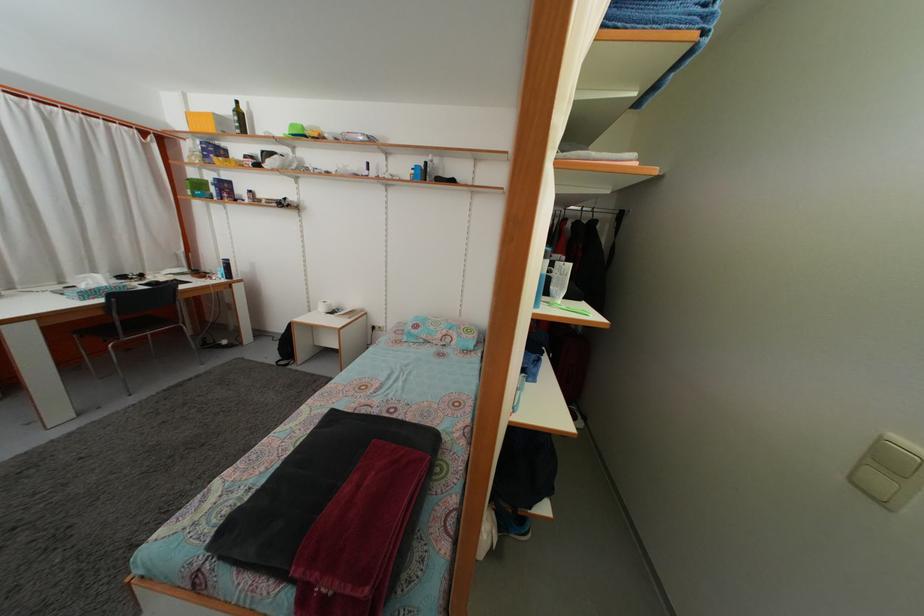
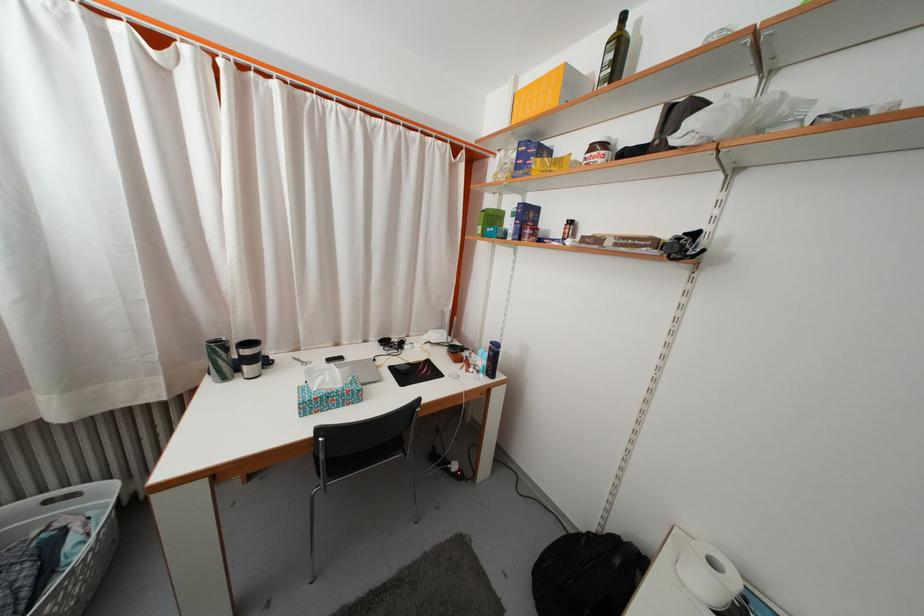
Find the pixel in the second image that matches point 246,122 in the first image.

(625, 54)